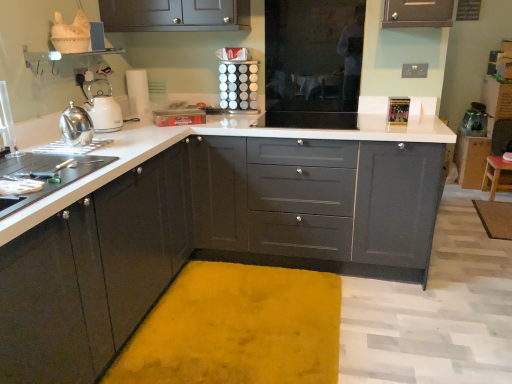
Question: From the image's perspective, relative to matte black cabinets at left, the first cabinetry viewed from the front, is matte gray cabinet at right, which is counted as the 3th cabinetry, starting from the left, above or below?

Choices:
 (A) above
 (B) below

Answer: (A)

Question: Looking at their shapes, would you say matte gray cabinet at right, which ranks as the first cabinetry in right-to-left order, is wider or thinner than matte black cabinets at left, placed as the third cabinetry when sorted from back to front?

Choices:
 (A) thin
 (B) wide

Answer: (A)

Question: Based on their relative distances, which object is farther from the shiny metallic kettle at left, the 2th kitchen appliance when ordered from back to front?

Choices:
 (A) yellow plush bath mat at lower right, the 2th bath mat viewed from the left
 (B) matte black cabinets at left, the first cabinetry viewed from the front
 (C) matte gray cabinets at center, which is counted as the second cabinetry, starting from the back
 (D) yellow plush bath mat at center, which is counted as the 2th bath mat, starting from the right
 (E) wooden stool at lower right

Answer: (E)

Question: Which of these objects is positioned closest to the metallic silver spice rack at upper center?

Choices:
 (A) yellow plush bath mat at center, placed as the 1th bath mat when sorted from front to back
 (B) matte gray cabinet at right, which ranks as the first cabinetry in right-to-left order
 (C) matte black cabinets at left, placed as the third cabinetry when sorted from back to front
 (D) wooden stool at lower right
 (E) matte gray cabinets at center, the second cabinetry from the left

Answer: (E)